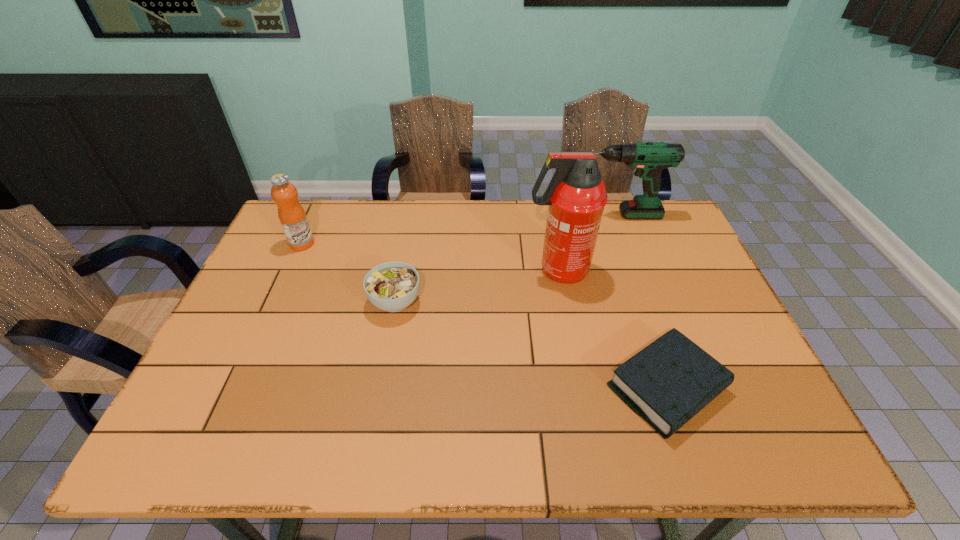
This screenshot has width=960, height=540. What are the coordinates of `object that is positioned at the left edge` in the screenshot? It's located at (292, 216).

You are a GUI agent. You are given a task and a screenshot of the screen. Output one action in this format:
    pyautogui.click(x=<x>, y=<y>)
    Task: Click on the drill at the right edge
    
    Given the screenshot: What is the action you would take?
    pyautogui.click(x=649, y=158)

The height and width of the screenshot is (540, 960). Identify the location of Bible present at the right edge. (667, 383).

Identify the location of object at the far left corner. pos(292,216).

The height and width of the screenshot is (540, 960). In order to click on object at the far right corner in this screenshot , I will do `click(649, 158)`.

Locate an element on the screen. Image resolution: width=960 pixels, height=540 pixels. object located at the near right corner is located at coordinates (667, 383).

Find the location of a particular element. The height and width of the screenshot is (540, 960). vacant space at the far edge of the desktop is located at coordinates (385, 217).

Locate an element on the screen. vacant position at the near edge of the desktop is located at coordinates (650, 441).

Where is `free space at the left edge of the desktop`? free space at the left edge of the desktop is located at coordinates (289, 254).

The image size is (960, 540). I want to click on free space at the right edge of the desktop, so click(x=684, y=330).